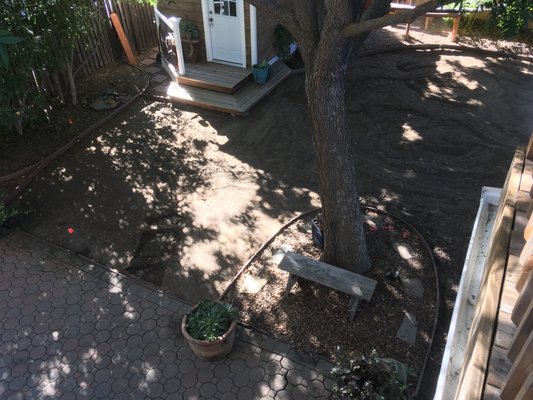
Find the location of `door handle`. door handle is located at coordinates (209, 18).